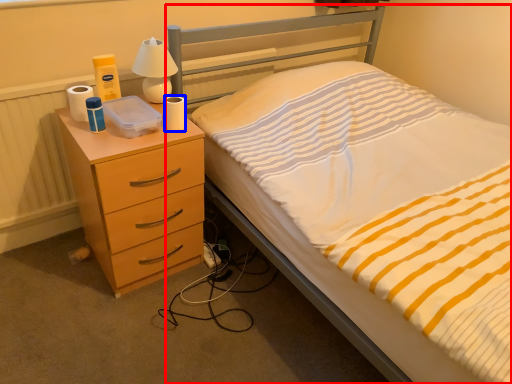
Question: Which of the following is the closest to the observer, bed (highlighted by a red box) or toilet paper (highlighted by a blue box)?

Choices:
 (A) bed
 (B) toilet paper

Answer: (A)